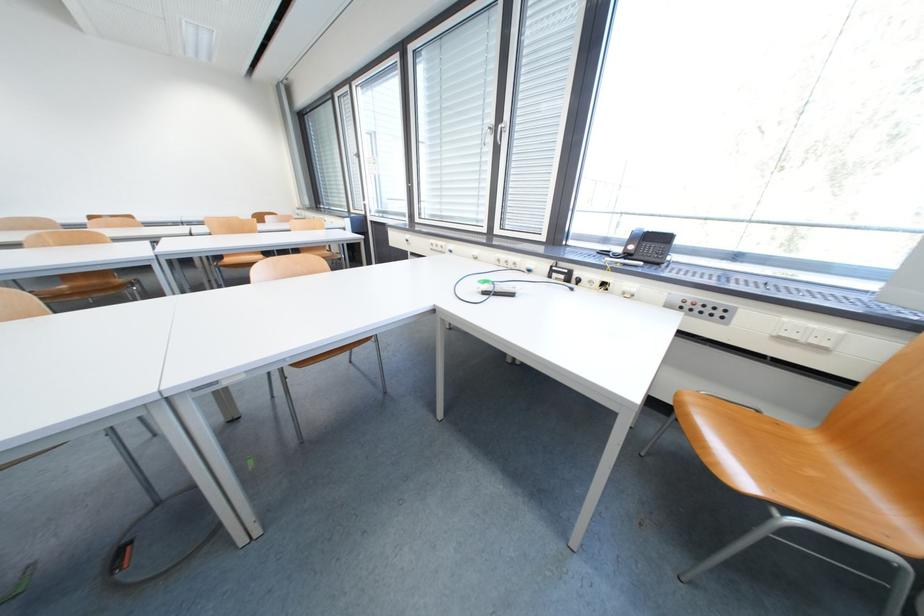
Locate an element on the screen. green power switch is located at coordinates (487, 286).